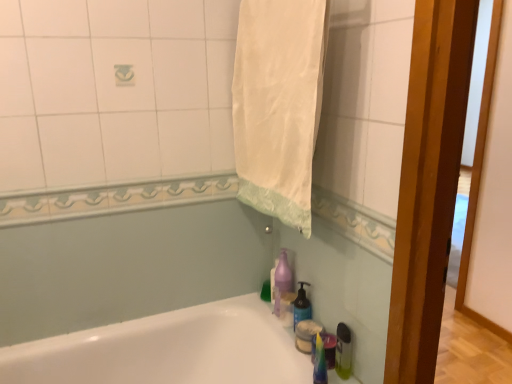
Question: From the image's perspective, is white glossy bathtub at lower left beneath translucent plastic soap dispenser at lower right?

Choices:
 (A) no
 (B) yes

Answer: (B)

Question: Would you say white glossy bathtub at lower left is a long distance from translucent plastic soap dispenser at lower right?

Choices:
 (A) yes
 (B) no

Answer: (B)

Question: From a real-world perspective, does white glossy bathtub at lower left stand above translucent plastic soap dispenser at lower right?

Choices:
 (A) no
 (B) yes

Answer: (A)

Question: Is the surface of white glossy bathtub at lower left in direct contact with translucent plastic soap dispenser at lower right?

Choices:
 (A) no
 (B) yes

Answer: (A)

Question: From the image's perspective, is white glossy bathtub at lower left on translucent plastic soap dispenser at lower right?

Choices:
 (A) no
 (B) yes

Answer: (A)

Question: Can you confirm if white glossy bathtub at lower left is positioned to the left of translucent plastic soap dispenser at lower right?

Choices:
 (A) no
 (B) yes

Answer: (B)

Question: From the image's perspective, is translucent plastic bottle at lower right below white glossy bathtub at lower left?

Choices:
 (A) yes
 (B) no

Answer: (B)

Question: Considering the relative sizes of translucent plastic bottle at lower right and white glossy bathtub at lower left in the image provided, is translucent plastic bottle at lower right taller than white glossy bathtub at lower left?

Choices:
 (A) yes
 (B) no

Answer: (B)

Question: Is translucent plastic bottle at lower right wider than white glossy bathtub at lower left?

Choices:
 (A) no
 (B) yes

Answer: (A)

Question: Is translucent plastic bottle at lower right shorter than white glossy bathtub at lower left?

Choices:
 (A) yes
 (B) no

Answer: (A)

Question: Can you confirm if translucent plastic bottle at lower right is positioned to the right of white glossy bathtub at lower left?

Choices:
 (A) yes
 (B) no

Answer: (A)

Question: Does translucent plastic bottle at lower right come behind white glossy bathtub at lower left?

Choices:
 (A) yes
 (B) no

Answer: (A)

Question: Considering the relative sizes of white fabric towel at upper center and purple translucent soap dispenser at lower center in the image provided, is white fabric towel at upper center smaller than purple translucent soap dispenser at lower center?

Choices:
 (A) yes
 (B) no

Answer: (B)